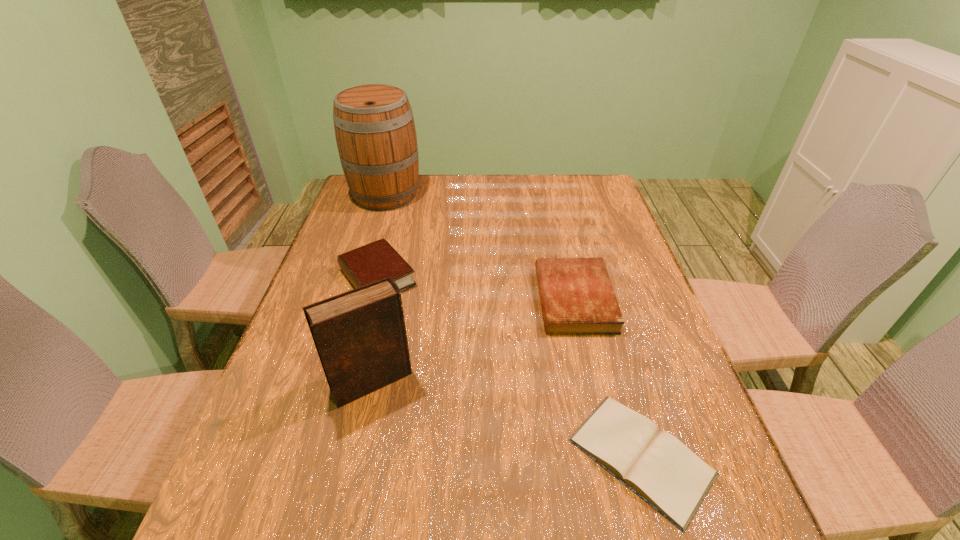
Where is `free space located 0.190m on the spine side of the third tallest Bible`? free space located 0.190m on the spine side of the third tallest Bible is located at coordinates (468, 299).

Locate an element on the screen. This screenshot has height=540, width=960. vacant space positioned on the spine side of the third tallest Bible is located at coordinates (438, 299).

Locate an element on the screen. This screenshot has width=960, height=540. free space located 0.150m on the left of the shortest Bible is located at coordinates (492, 456).

Locate an element on the screen. The width and height of the screenshot is (960, 540). object that is positioned at the far edge is located at coordinates (375, 132).

At what (x,y) coordinates should I click in order to perform the action: click on object present at the near edge. Please return your answer as a coordinate pair (x, y). Looking at the image, I should click on (655, 465).

This screenshot has width=960, height=540. I want to click on cider that is at the left edge, so click(x=375, y=132).

At what (x,y) coordinates should I click in order to perform the action: click on object at the far left corner. Please return your answer as a coordinate pair (x, y). Image resolution: width=960 pixels, height=540 pixels. Looking at the image, I should click on (375, 132).

Find the location of a particular element. The image size is (960, 540). object positioned at the near right corner is located at coordinates (655, 465).

In the image, there is a desktop. Identify the location of blank space at the far edge. The height and width of the screenshot is (540, 960). (421, 192).

Image resolution: width=960 pixels, height=540 pixels. Find the location of `vacant region at the left edge of the desktop`. vacant region at the left edge of the desktop is located at coordinates (288, 355).